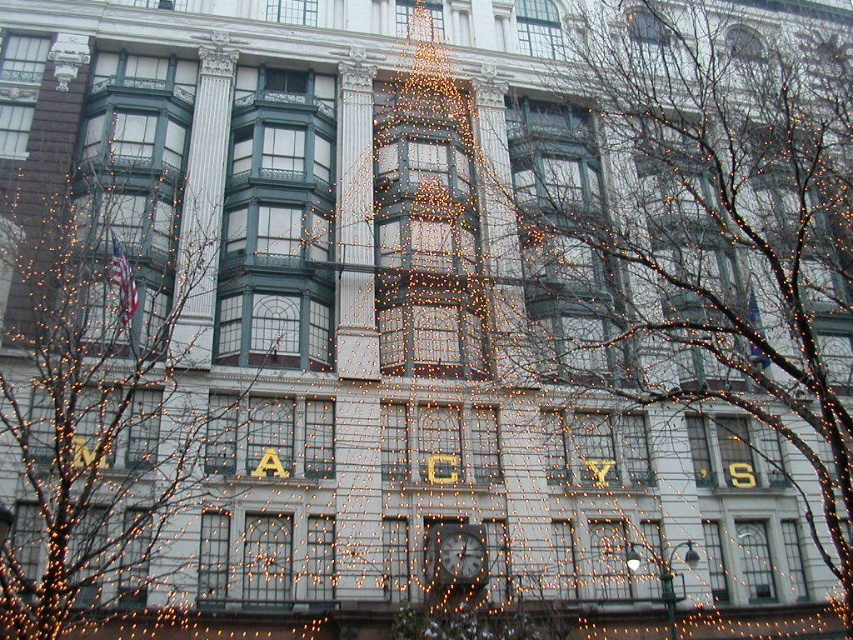
You are standing in front of the Macy store and want to see both the bare branches at center and the metallic clock at center. Which one is higher up on the building?

The bare branches at center is positioned over metallic clock at center, so it is higher up on the building.

You are standing in front of the Macy store and want to see the metallic clock at center. However, the illuminated wireframe tree at center is blocking your view. Can you walk around the tree to see the clock?

The illuminated wireframe tree at center is in front of metallic clock at center, so you can walk around the tree to see the clock behind it.

You are an architect planning to install a new decorative element between the bare branches at center and the metallic clock at center on the building facade. The decorative element requires a minimum of 25 meters of space. Based on the provided information, will there be sufficient space to accommodate it?

The distance between the bare branches at center and the metallic clock at center is 26.88 meters, which exceeds the required 25 meters. Therefore, there is sufficient space to install the decorative element between them.